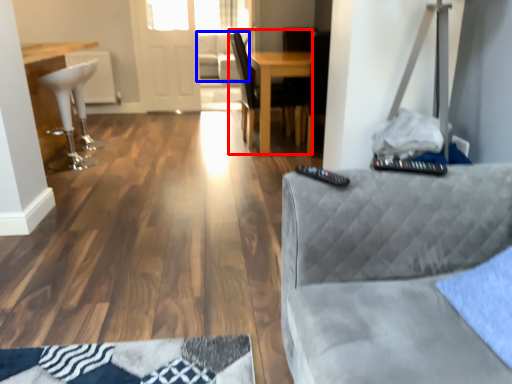
Question: Which point is further to the camera, chair (highlighted by a red box) or couch (highlighted by a blue box)?

Choices:
 (A) chair
 (B) couch

Answer: (B)